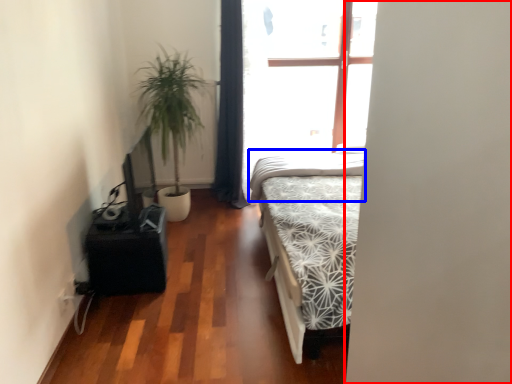
Question: Which object is closer to the camera taking this photo, screen door (highlighted by a red box) or mattress (highlighted by a blue box)?

Choices:
 (A) screen door
 (B) mattress

Answer: (A)